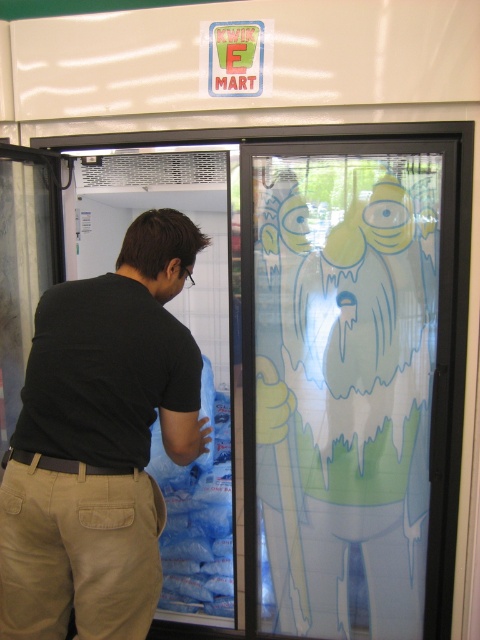
Question: Which object is positioned farthest from the khaki cotton pants at lower left?

Choices:
 (A) black matte shirt at center
 (B) transparent plastic screen door at right

Answer: (B)

Question: Does black matte shirt at center have a smaller size compared to khaki cotton pants at lower left?

Choices:
 (A) no
 (B) yes

Answer: (A)

Question: Where is black matte shirt at center located in relation to khaki cotton pants at lower left in the image?

Choices:
 (A) below
 (B) above

Answer: (B)

Question: Which object is positioned farthest from the khaki cotton pants at lower left?

Choices:
 (A) black matte shirt at center
 (B) transparent plastic screen door at right

Answer: (B)

Question: Which object is the farthest from the khaki cotton pants at lower left?

Choices:
 (A) black matte shirt at center
 (B) transparent plastic screen door at right

Answer: (B)

Question: Can you confirm if transparent plastic screen door at right is positioned to the right of khaki cotton pants at lower left?

Choices:
 (A) yes
 (B) no

Answer: (A)